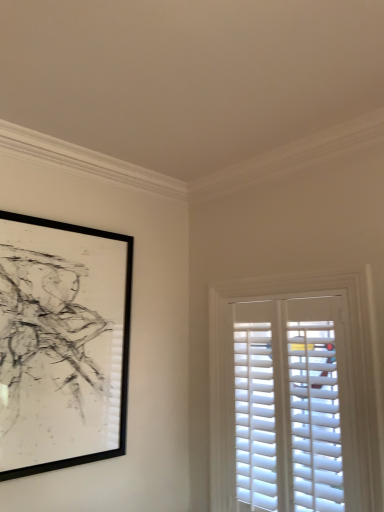
Question: Should I look upward or downward to see black matte picture frame at upper left?

Choices:
 (A) down
 (B) up

Answer: (A)